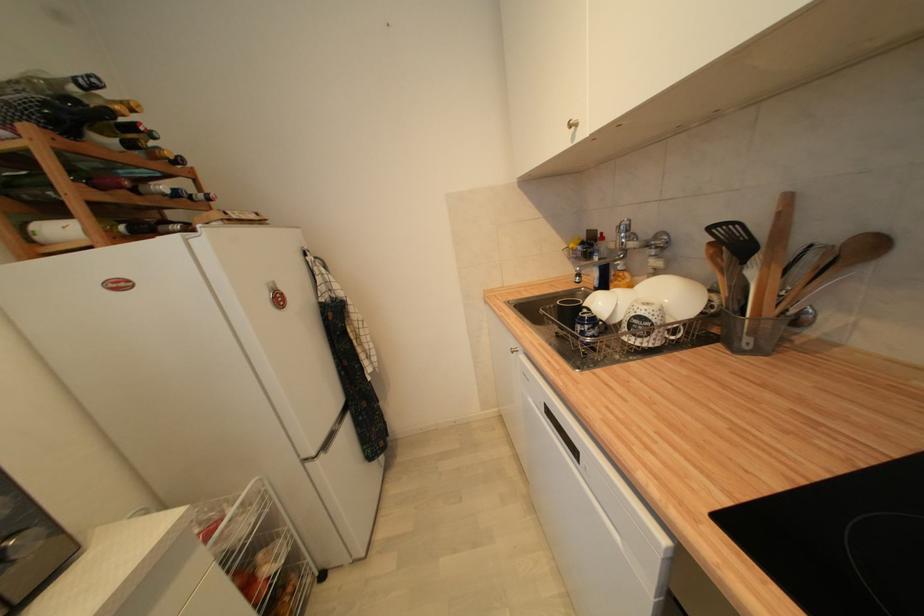
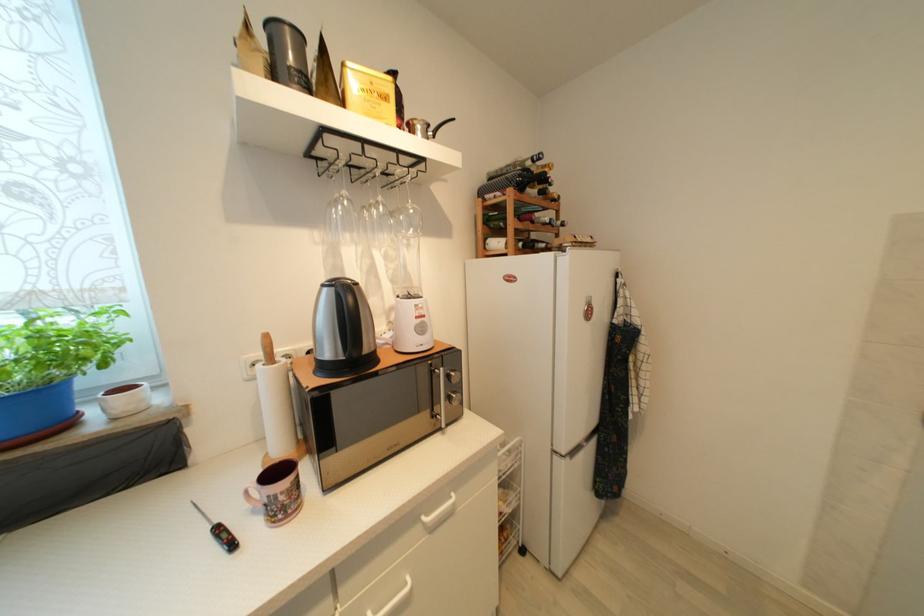
Question: The camera is either moving clockwise (left) or counter-clockwise (right) around the object. The first image is from the beginning of the video and the second image is from the end. Is the camera moving left or right when shooting the video?

Choices:
 (A) Left
 (B) Right

Answer: (B)